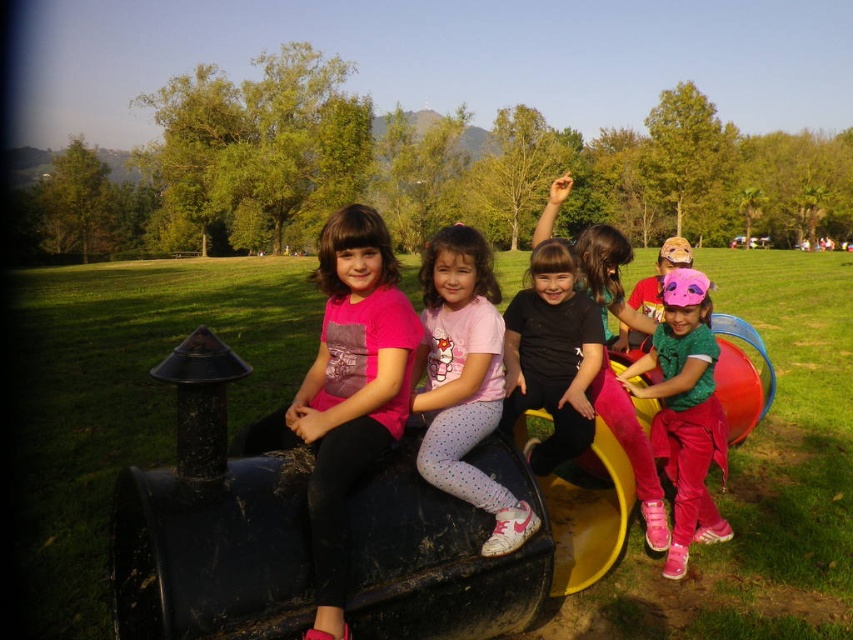
Looking at this image, you are a photographer trying to capture a photo of the black matte shirt at center without including the matte pink shirt at left in the frame. Based on their positions, is this possible?

The matte pink shirt at left is in front of the black matte shirt at center, so it would block the view. Move the camera angle or have the matte pink shirt at left move to capture the black matte shirt at center alone.

You are a photographer trying to capture a clear shot of the pink fabric mask at center and the black matte shirt at center. Which object should you focus on first if you want to ensure both are in focus without adjusting the camera settings?

The pink fabric mask at center is much taller than the black matte shirt at center, so focusing on the pink fabric mask at center first would ensure both are in focus since it is larger and closer to the camera.